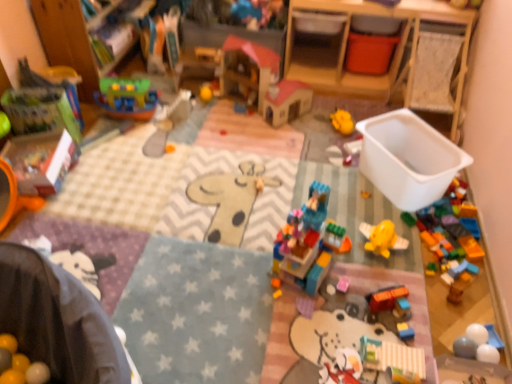
Locate an element on the screen. blank space to the left of translucent plastic airplane at center, placed as the fourth toy when sorted from bottom to top is located at coordinates (335, 190).